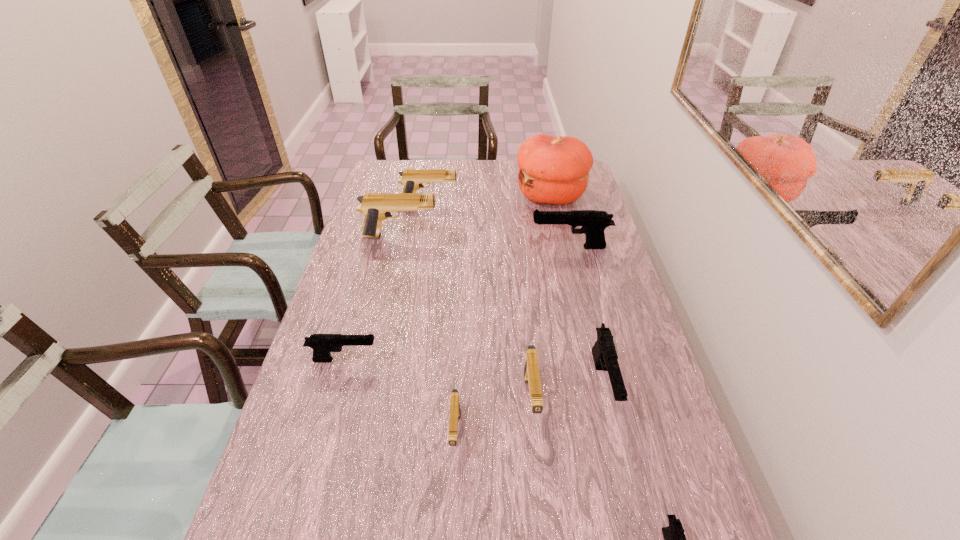
At what (x,y) coordinates should I click in order to perform the action: click on tan pistol that can be found as the fourth closest to the second biggest black pistol. Please return your answer as a coordinate pair (x, y). The width and height of the screenshot is (960, 540). Looking at the image, I should click on (412, 179).

Identify which black pistol is the fourth closest to the second farthest tan pistol. Please provide its 2D coordinates. Your answer should be formatted as a tuple, i.e. [(x, y)], where the tuple contains the x and y coordinates of a point satisfying the conditions above.

[(674, 537)]

Choose which black pistol is the third nearest neighbor to the third biggest tan pistol. Please provide its 2D coordinates. Your answer should be formatted as a tuple, i.e. [(x, y)], where the tuple contains the x and y coordinates of a point satisfying the conditions above.

[(322, 344)]

This screenshot has height=540, width=960. I want to click on vacant point that satisfies the following two spatial constraints: 1. on the front-facing side of the sixth nearest pistol; 2. at the barrel of the third biggest tan pistol, so click(607, 400).

Locate an element on the screen. blank space that satisfies the following two spatial constraints: 1. on the front-facing side of the fourth farthest object; 2. at the barrel of the sixth object from right to left is located at coordinates (615, 432).

The image size is (960, 540). In order to click on free spot that satisfies the following two spatial constraints: 1. on the front-facing side of the farthest black pistol; 2. at the barrel of the smallest tan pistol in this screenshot , I will do `click(615, 432)`.